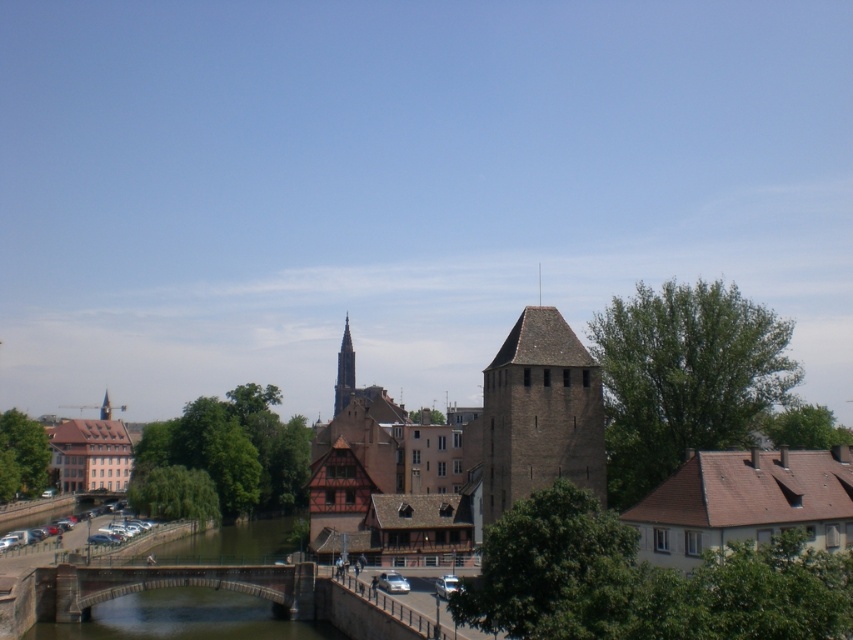
You are a tourist standing at the riverbank and want to take a photo of the brown brick tower at center. The camera you have can focus on objects up to 100 meters away. Will the tower be in focus?

The brown brick tower at center is 82.01 meters from camera, which is within the camera focus range of 100 meters. Therefore, the tower will be in focus.

You are standing at the point labeled as point (167, 586) in the image. What structure are you currently on?

The point (167, 586) indicates that you are on the concrete stone bridge at lower center.